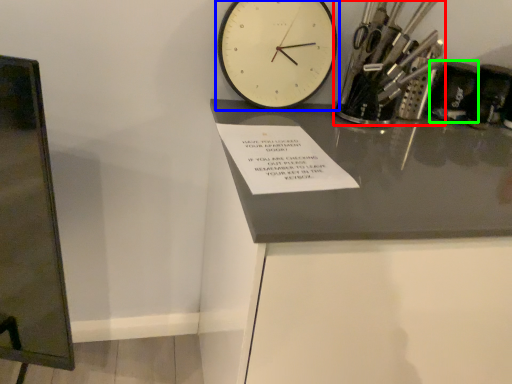
Question: Which object is the farthest from stationery (highlighted by a red box)? Choose among these: wall clock (highlighted by a blue box) or stationery (highlighted by a green box).

Choices:
 (A) wall clock
 (B) stationery

Answer: (A)